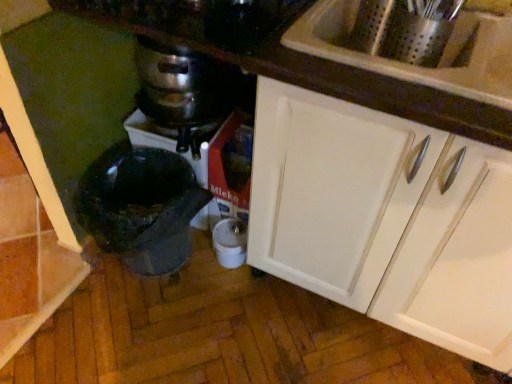
Locate an element on the screen. free space in front of black matte mortar at lower left, placed as the 1th appliance when sorted from left to right is located at coordinates (128, 332).